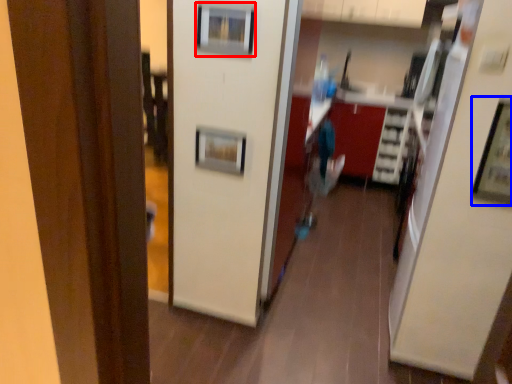
Question: Which object is further to the camera taking this photo, picture frame (highlighted by a red box) or picture frame (highlighted by a blue box)?

Choices:
 (A) picture frame
 (B) picture frame

Answer: (A)